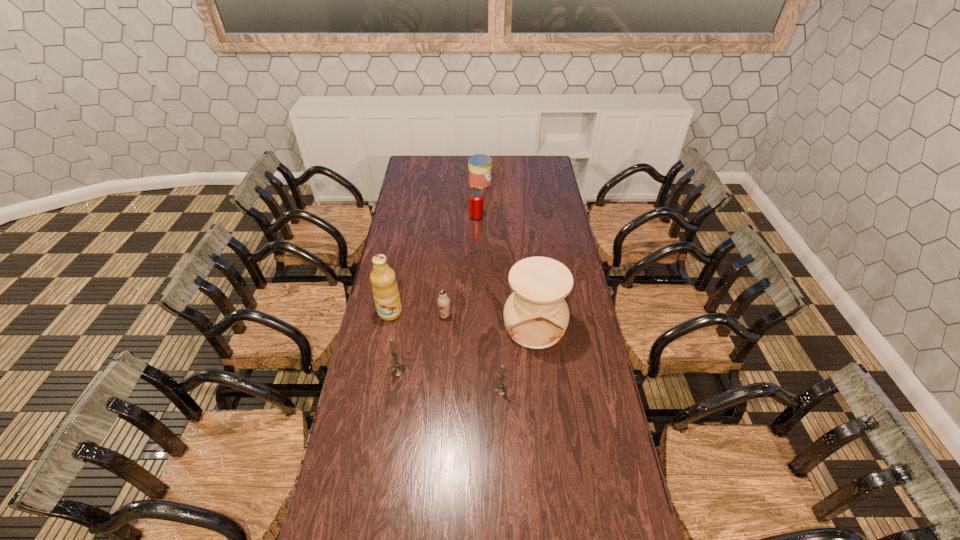
Find the location of a particular element. This screenshot has width=960, height=540. the left candle is located at coordinates (396, 370).

Find the location of a particular element. This screenshot has height=540, width=960. the second nearest object is located at coordinates (396, 370).

Locate an element on the screen. The height and width of the screenshot is (540, 960). the right candle is located at coordinates (501, 389).

Image resolution: width=960 pixels, height=540 pixels. In order to click on the nearest object in this screenshot , I will do `click(501, 389)`.

Where is `the nearer can`? the nearer can is located at coordinates (476, 197).

Find the location of a particular element. The width and height of the screenshot is (960, 540). the farthest object is located at coordinates (479, 165).

At what (x,y) coordinates should I click in order to perform the action: click on the third object from left to right. Please return your answer as a coordinate pair (x, y). The width and height of the screenshot is (960, 540). Looking at the image, I should click on (443, 301).

The width and height of the screenshot is (960, 540). Find the location of `pottery`. pottery is located at coordinates (536, 315).

The image size is (960, 540). Identify the location of olive oil. (385, 290).

At what (x,y) coordinates should I click in order to perform the action: click on vacant space located on the front of the farther candle. Please return your answer as a coordinate pair (x, y). Image resolution: width=960 pixels, height=540 pixels. Looking at the image, I should click on [x=381, y=474].